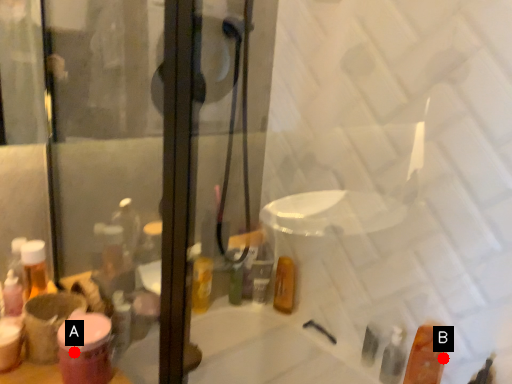
Question: Two points are circled on the image, labeled by A and B beside each circle. Which point is farther from the camera taking this photo?

Choices:
 (A) A is further
 (B) B is further

Answer: (B)